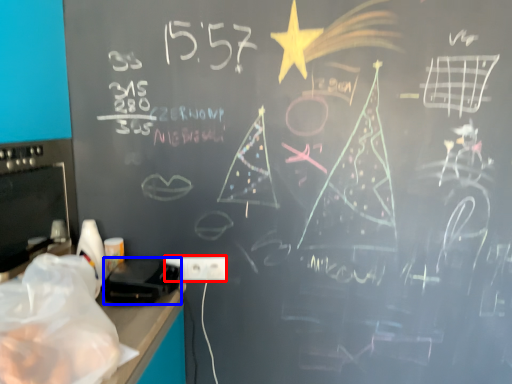
Question: Which object is closer to the camera taking this photo, electric outlet (highlighted by a red box) or equipment (highlighted by a blue box)?

Choices:
 (A) electric outlet
 (B) equipment

Answer: (B)